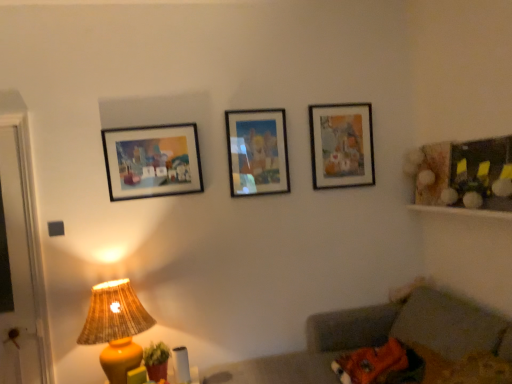
Question: Can you confirm if gray fabric couch at lower right is thinner than matte wooden picture frame at upper right, acting as the third picture frame starting from the front?

Choices:
 (A) no
 (B) yes

Answer: (A)

Question: Would you say matte wooden picture frame at upper right, the 3th picture frame when ordered from left to right, is part of gray fabric couch at lower right's contents?

Choices:
 (A) yes
 (B) no

Answer: (B)

Question: Is gray fabric couch at lower right behind matte wooden picture frame at upper right, marked as the 1th picture frame in a right-to-left arrangement?

Choices:
 (A) no
 (B) yes

Answer: (A)

Question: Can you confirm if gray fabric couch at lower right is positioned to the right of matte wooden picture frame at upper right, the 3th picture frame when ordered from left to right?

Choices:
 (A) no
 (B) yes

Answer: (A)

Question: Are gray fabric couch at lower right and matte wooden picture frame at upper right, which ranks as the first picture frame in back-to-front order, located far from each other?

Choices:
 (A) yes
 (B) no

Answer: (A)

Question: Considering the relative sizes of gray fabric couch at lower right and matte wooden picture frame at upper right, acting as the third picture frame starting from the front, in the image provided, is gray fabric couch at lower right taller than matte wooden picture frame at upper right, acting as the third picture frame starting from the front,?

Choices:
 (A) no
 (B) yes

Answer: (B)

Question: Does matte plastic picture frame at center, positioned as the 2th picture frame in front-to-back order, have a lesser height compared to gray fabric couch at lower right?

Choices:
 (A) no
 (B) yes

Answer: (B)

Question: Can you confirm if matte plastic picture frame at center, arranged as the 2th picture frame when viewed from the back, is smaller than gray fabric couch at lower right?

Choices:
 (A) no
 (B) yes

Answer: (B)

Question: From a real-world perspective, is matte plastic picture frame at center, arranged as the 2th picture frame when viewed from the back, beneath gray fabric couch at lower right?

Choices:
 (A) no
 (B) yes

Answer: (A)

Question: Is gray fabric couch at lower right inside matte plastic picture frame at center, positioned as the 2th picture frame in front-to-back order?

Choices:
 (A) yes
 (B) no

Answer: (B)

Question: From the image's perspective, would you say matte plastic picture frame at center, arranged as the 2th picture frame when viewed from the back, is shown under gray fabric couch at lower right?

Choices:
 (A) yes
 (B) no

Answer: (B)

Question: Are matte plastic picture frame at center, arranged as the 2th picture frame when viewed from the back, and gray fabric couch at lower right making contact?

Choices:
 (A) yes
 (B) no

Answer: (B)

Question: Considering the relative sizes of matte wooden picture frame at upper right, which ranks as the first picture frame in back-to-front order, and matte plastic picture frame at center, arranged as the 2th picture frame when viewed from the back, in the image provided, is matte wooden picture frame at upper right, which ranks as the first picture frame in back-to-front order, wider than matte plastic picture frame at center, arranged as the 2th picture frame when viewed from the back,?

Choices:
 (A) no
 (B) yes

Answer: (B)